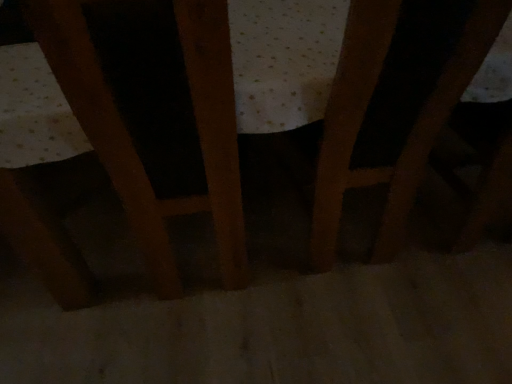
Locate an element on the screen. free spot to the right of wooden chair at center is located at coordinates (314, 264).